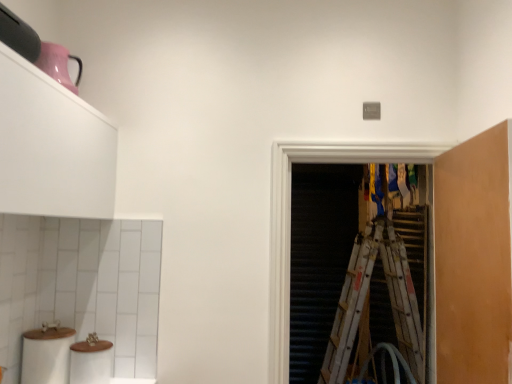
Question: Is wooden ladder at right behind transparent plastic screen door at center?

Choices:
 (A) yes
 (B) no

Answer: (A)

Question: From the image's perspective, is wooden ladder at right below transparent plastic screen door at center?

Choices:
 (A) no
 (B) yes

Answer: (B)

Question: From a real-world perspective, is wooden ladder at right over transparent plastic screen door at center?

Choices:
 (A) no
 (B) yes

Answer: (A)

Question: Is wooden ladder at right outside transparent plastic screen door at center?

Choices:
 (A) no
 (B) yes

Answer: (B)

Question: Can you confirm if wooden ladder at right is shorter than transparent plastic screen door at center?

Choices:
 (A) yes
 (B) no

Answer: (B)

Question: Would you say white matte cabinet at upper left, which is the first cabinetry in left-to-right order, is inside or outside matte orange cabinet at right, which is the second cabinetry from left to right?

Choices:
 (A) inside
 (B) outside

Answer: (B)

Question: Is white matte cabinet at upper left, arranged as the 2th cabinetry when viewed from the right, in front of or behind matte orange cabinet at right, positioned as the first cabinetry in right-to-left order, in the image?

Choices:
 (A) front
 (B) behind

Answer: (A)

Question: From their relative heights in the image, would you say white matte cabinet at upper left, which is the first cabinetry in left-to-right order, is taller or shorter than matte orange cabinet at right, positioned as the first cabinetry in right-to-left order?

Choices:
 (A) short
 (B) tall

Answer: (A)

Question: From a real-world perspective, is white matte cabinet at upper left, arranged as the 2th cabinetry when viewed from the right, positioned above or below matte orange cabinet at right, positioned as the first cabinetry in right-to-left order?

Choices:
 (A) above
 (B) below

Answer: (A)

Question: In terms of height, does white matte toilet paper at lower left look taller or shorter compared to matte orange cabinet at right, positioned as the first cabinetry in right-to-left order?

Choices:
 (A) tall
 (B) short

Answer: (B)

Question: From the image's perspective, is white matte toilet paper at lower left located above or below matte orange cabinet at right, positioned as the first cabinetry in right-to-left order?

Choices:
 (A) below
 (B) above

Answer: (A)

Question: Considering the positions of point (39, 344) and point (451, 175), is point (39, 344) closer or farther from the camera than point (451, 175)?

Choices:
 (A) farther
 (B) closer

Answer: (B)

Question: In terms of size, does white matte toilet paper at lower left appear bigger or smaller than matte orange cabinet at right, positioned as the first cabinetry in right-to-left order?

Choices:
 (A) small
 (B) big

Answer: (A)

Question: Considering the positions of white matte cabinet at upper left, which is the first cabinetry in left-to-right order, and white matte toilet paper at lower left in the image, is white matte cabinet at upper left, which is the first cabinetry in left-to-right order, taller or shorter than white matte toilet paper at lower left?

Choices:
 (A) short
 (B) tall

Answer: (B)

Question: Considering the relative positions of white matte cabinet at upper left, arranged as the 2th cabinetry when viewed from the right, and white matte toilet paper at lower left in the image provided, is white matte cabinet at upper left, arranged as the 2th cabinetry when viewed from the right, to the left or to the right of white matte toilet paper at lower left?

Choices:
 (A) right
 (B) left

Answer: (A)